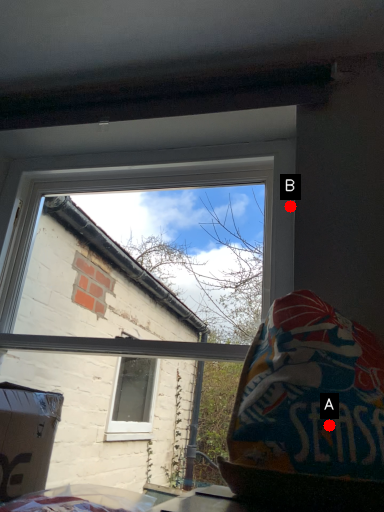
Question: Two points are circled on the image, labeled by A and B beside each circle. Among these points, which one is farthest from the camera?

Choices:
 (A) A is further
 (B) B is further

Answer: (B)